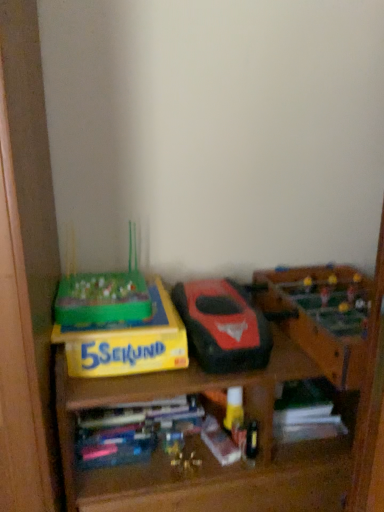
Question: Looking at the image, does multicolored plastic books at center, placed as the 2th book when sorted from right to left, seem bigger or smaller compared to matte black toy car at center, arranged as the second toy when viewed from the right?

Choices:
 (A) small
 (B) big

Answer: (A)

Question: Considering the positions of multicolored plastic books at center, placed as the 2th book when sorted from right to left, and matte black toy car at center, which ranks as the first toy in left-to-right order, in the image, is multicolored plastic books at center, placed as the 2th book when sorted from right to left, taller or shorter than matte black toy car at center, which ranks as the first toy in left-to-right order,?

Choices:
 (A) short
 (B) tall

Answer: (A)

Question: Which is nearer to the wooden foosball table at right, arranged as the first toy when viewed from the right?

Choices:
 (A) matte black toy car at center, which ranks as the first toy in left-to-right order
 (B) multicolored plastic books at center, placed as the 2th book when sorted from right to left
 (C) yellow matte board game at left
 (D) yellow cardboard box at left
 (E) white matte book at lower right, acting as the 1th book starting from the right

Answer: (A)

Question: Which is farther from the yellow cardboard box at left?

Choices:
 (A) multicolored plastic books at center, placed as the 2th book when sorted from right to left
 (B) matte black toy car at center, which ranks as the first toy in left-to-right order
 (C) yellow matte board game at left
 (D) wooden foosball table at right, which is the 2th toy in left-to-right order
 (E) white matte book at lower right, acting as the 1th book starting from the right

Answer: (D)